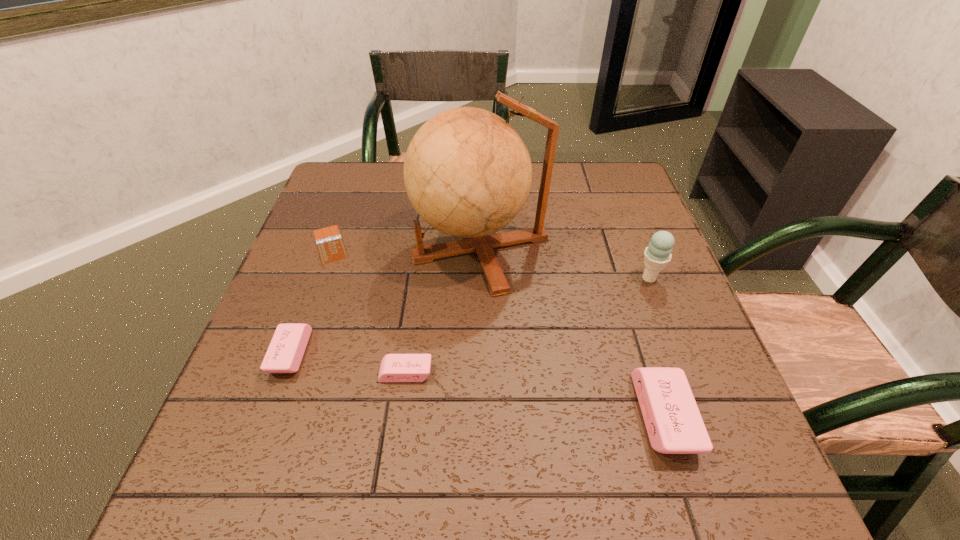
This screenshot has height=540, width=960. I want to click on vacant space that's between the second tallest object and the leftmost eraser, so click(469, 316).

This screenshot has height=540, width=960. Find the location of `free space between the fourth shortest object and the leftmost eraser`. free space between the fourth shortest object and the leftmost eraser is located at coordinates point(477,384).

Locate an element on the screen. vacant space that's between the fourth shortest object and the chocolate bar is located at coordinates (497, 330).

The height and width of the screenshot is (540, 960). Identify the location of empty space that is in between the second tallest eraser and the rightmost eraser. (477, 384).

The width and height of the screenshot is (960, 540). Identify the location of vacant space in between the fifth shortest object and the rightmost eraser. (657, 347).

Find the location of `vacant area that lies between the chocolate bar and the fifth tallest object`. vacant area that lies between the chocolate bar and the fifth tallest object is located at coordinates (x=368, y=308).

Identify which object is located as the nearest to the second tallest eraser. Please provide its 2D coordinates. Your answer should be formatted as a tuple, i.e. [(x, y)], where the tuple contains the x and y coordinates of a point satisfying the conditions above.

[(394, 367)]

Identify the location of object that ranks as the closest to the second tallest eraser. The width and height of the screenshot is (960, 540). tap(394, 367).

I want to click on the closest eraser to the tallest object, so coord(394,367).

Select which eraser is the closest to the second eraser from right to left. Please provide its 2D coordinates. Your answer should be formatted as a tuple, i.e. [(x, y)], where the tuple contains the x and y coordinates of a point satisfying the conditions above.

[(285, 352)]